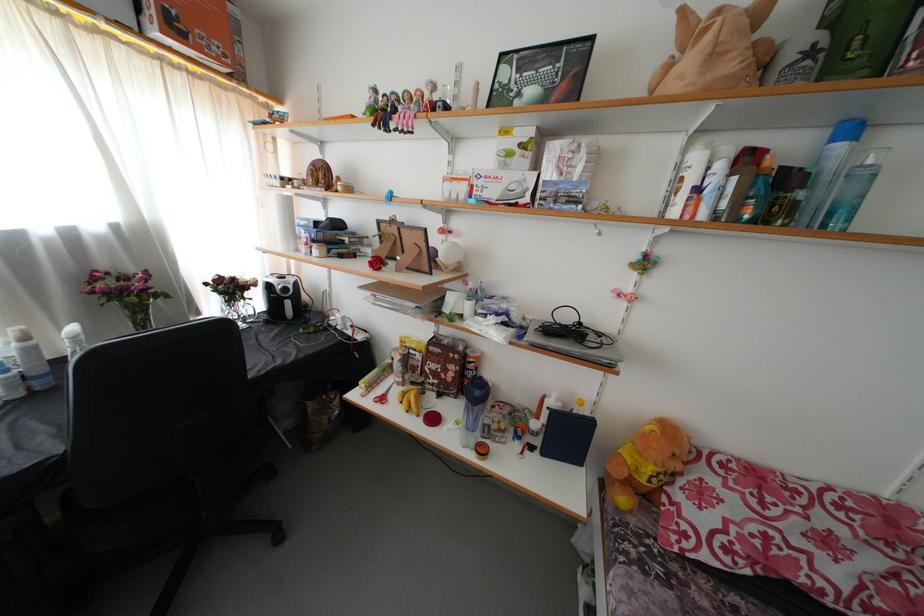
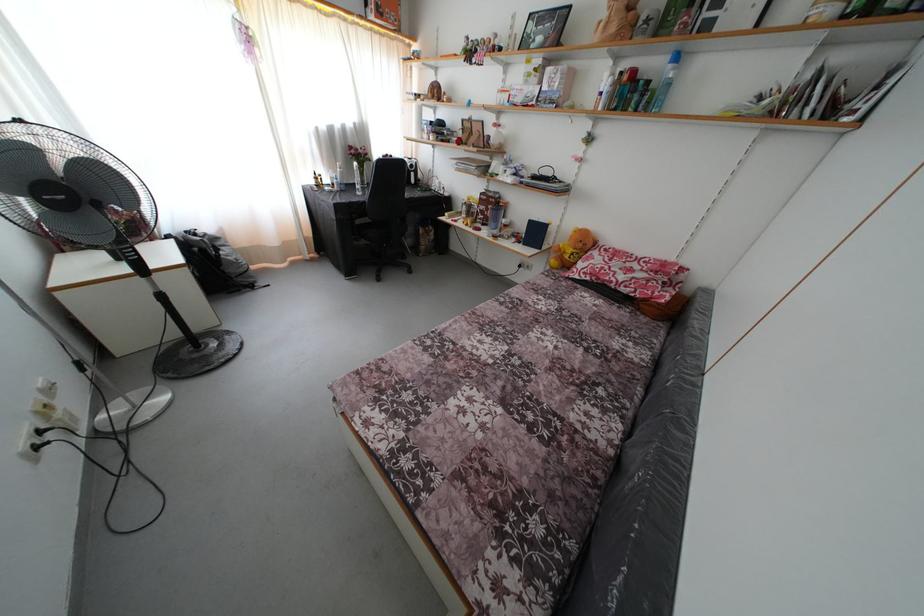
Find the pixel in the second image that matches (x=845, y=153) in the first image.

(675, 73)